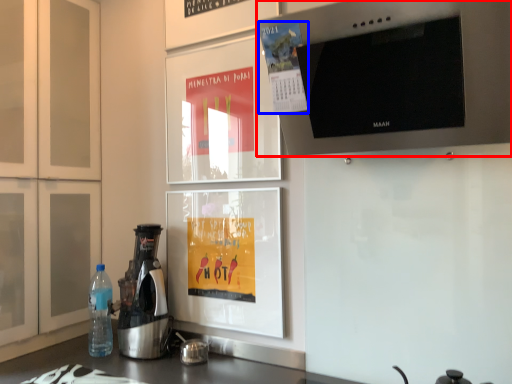
Question: Among these objects, which one is farthest to the camera, home appliance (highlighted by a red box) or poster (highlighted by a blue box)?

Choices:
 (A) home appliance
 (B) poster

Answer: (B)